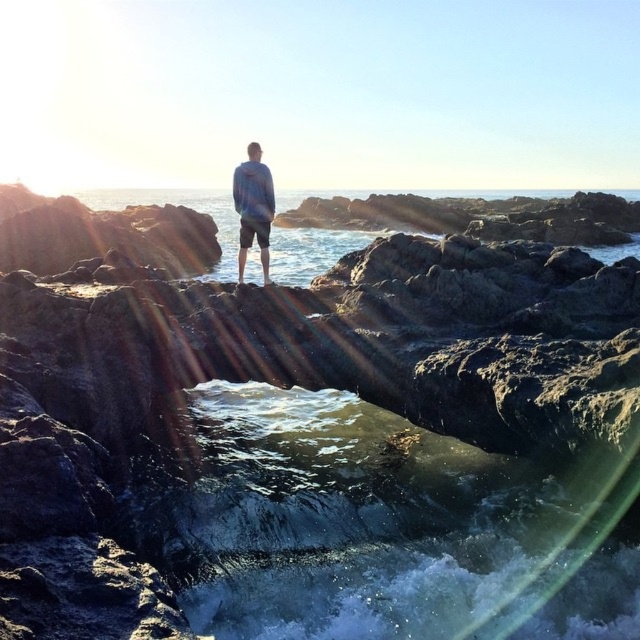
Question: Is rough textured rock at center positioned at the back of blue cotton hoodie at center?

Choices:
 (A) no
 (B) yes

Answer: (A)

Question: Which object is farther from the camera taking this photo?

Choices:
 (A) blue cotton hoodie at center
 (B) rough textured rock at center

Answer: (A)

Question: Is rough textured rock at center smaller than blue cotton hoodie at center?

Choices:
 (A) yes
 (B) no

Answer: (B)

Question: Among these points, which one is nearest to the camera?

Choices:
 (A) (266, 240)
 (B) (481, 433)

Answer: (B)

Question: In this image, where is rough textured rock at center located relative to blue cotton hoodie at center?

Choices:
 (A) left
 (B) right

Answer: (B)